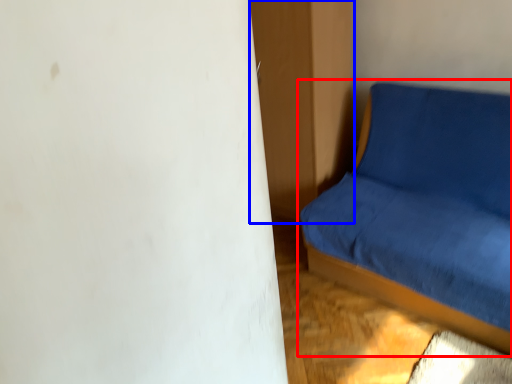
Question: Which object appears farthest to the camera in this image, studio couch (highlighted by a red box) or dresser (highlighted by a blue box)?

Choices:
 (A) studio couch
 (B) dresser

Answer: (B)